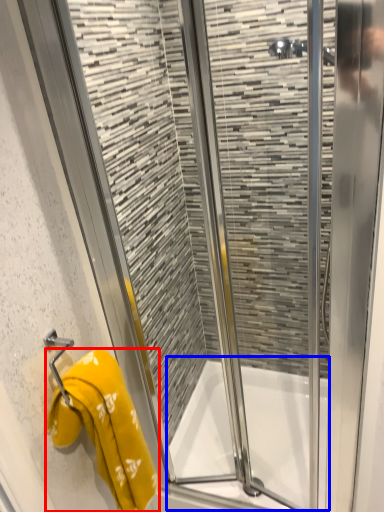
Question: Which point is closer to the camera, towel (highlighted by a red box) or bath (highlighted by a blue box)?

Choices:
 (A) towel
 (B) bath

Answer: (A)